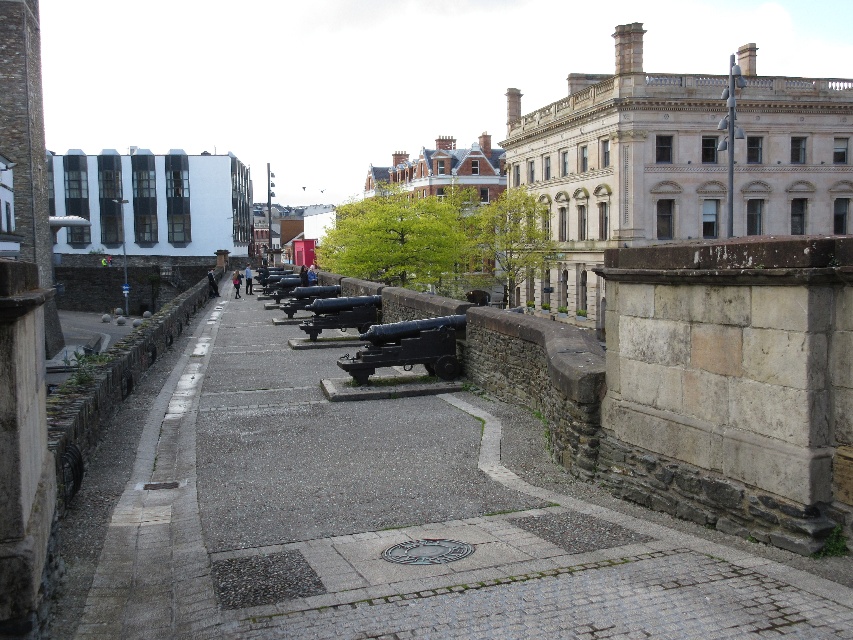
Based on the photo, who is positioned more to the left, stone paved path at center or black matte cannon at center?

From the viewer's perspective, stone paved path at center appears more on the left side.

Can you confirm if stone paved path at center is taller than black matte cannon at center?

Indeed, stone paved path at center has a greater height compared to black matte cannon at center.

Image resolution: width=853 pixels, height=640 pixels. What are the coordinates of `stone paved path at center` in the screenshot? It's located at (392, 518).

Between black matte cannon at center and polished bronze cannon at center, which one is positioned higher?

Positioned higher is polished bronze cannon at center.

Is point (456, 369) positioned behind point (366, 307)?

No, (456, 369) is closer to viewer.

Locate an element on the screen. The height and width of the screenshot is (640, 853). black matte cannon at center is located at coordinates (407, 348).

Find the location of `black matte cannon at center`. black matte cannon at center is located at coordinates (407, 348).

Is point (120, 544) positioned before point (352, 305)?

Yes, it is.

You are a GUI agent. You are given a task and a screenshot of the screen. Output one action in this format:
    pyautogui.click(x=<x>, y=<y>)
    Task: Click on the stone paved path at center
    This screenshot has height=640, width=853.
    Given the screenshot: What is the action you would take?
    [392, 518]